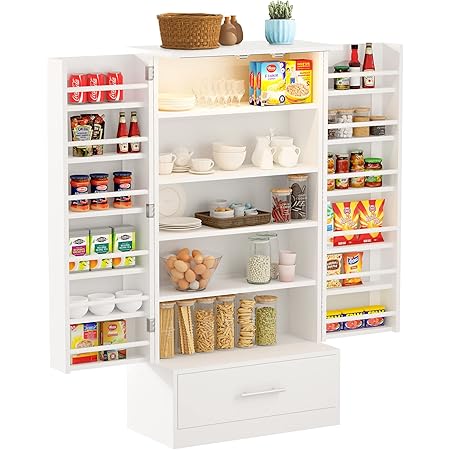
The height and width of the screenshot is (450, 450). Find the location of `bowls`. bowls is located at coordinates click(x=103, y=308), click(x=83, y=307), click(x=133, y=306), click(x=228, y=161), click(x=226, y=147).